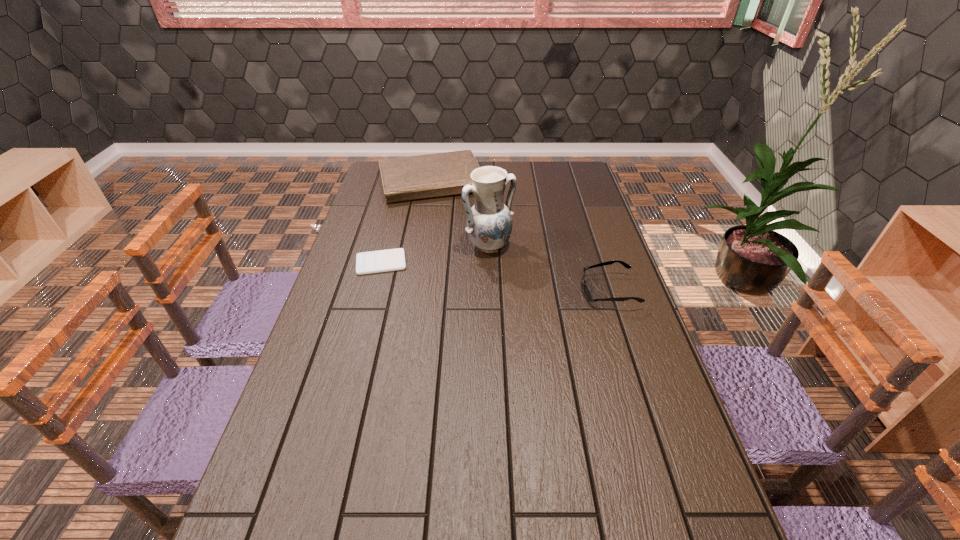
You are a GUI agent. You are given a task and a screenshot of the screen. Output one action in this format:
    pyautogui.click(x=<x>, y=<y>)
    Task: Click on the vacant region that satisfies the following two spatial constraints: 1. on the front side of the rightmost object; 2. on the lenses of the shortest object
    
    Given the screenshot: What is the action you would take?
    pyautogui.click(x=373, y=291)